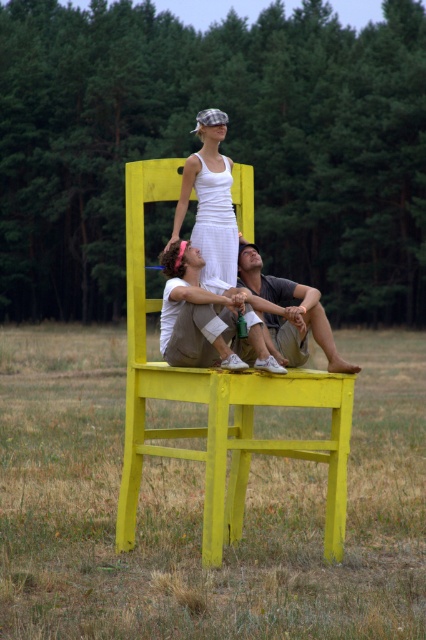
You are a photographer setting up a shoot in the grassy field. You have a yellow painted wood chair at center and a matte white dress at center. Which object is narrower when viewed from the front?

The yellow painted wood chair at center is thinner than the matte white dress at center, so the yellow painted wood chair at center is narrower when viewed from the front.

You are standing at the origin point of the coordinate system. You want to move to the yellow wood chair at center. What are the coordinates you need to move to reach it?

The yellow wood chair at center is located at coordinates point (201, 509). So you need to move to coordinates point (201, 509) to reach it.